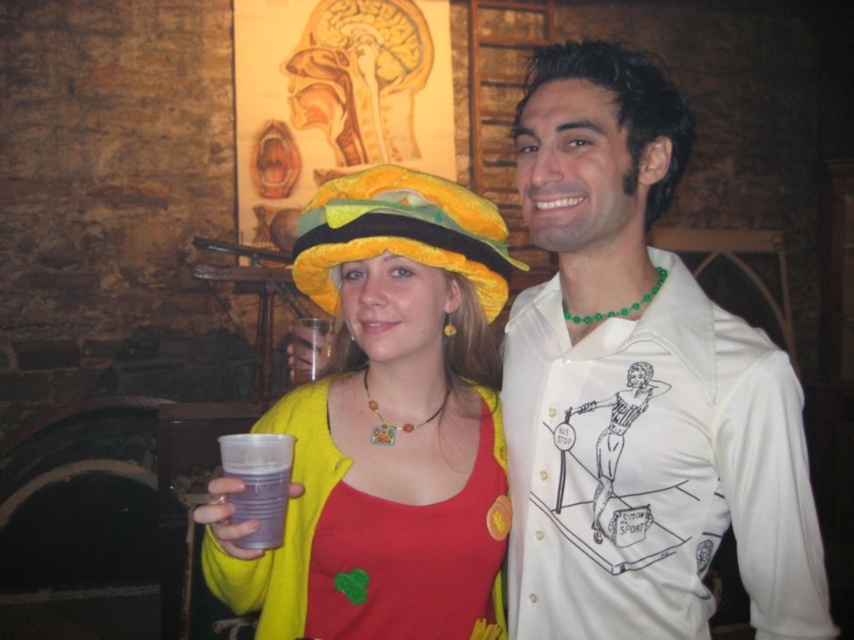
You are at a party and want to take a photo with the white glossy shirt at center and the fuzzy yellow hat at center. Which one should you focus on first if you want to capture both in the same frame?

The white glossy shirt at center is below the fuzzy yellow hat at center, so you should focus on the fuzzy yellow hat at center first to ensure both are in the frame.

You are at a party and want to find the person wearing the white glossy shirt at center. According to the spatial coordinates provided, where should you look relative to the image frame?

The white glossy shirt at center is located at point coordinates 0.606 on the x axis and 0.748 on the y axis, so you should look towards the right and lower middle area of the image frame.

You are a photographer at a party and need to capture a closeup shot of the white glossy shirt at center and the translucent plastic cup at lower center in the same frame. The camera you are using has a minimum focus distance of 20 inches. Can you take the photo without moving either object?

The white glossy shirt at center and translucent plastic cup at lower center are 19.54 inches apart, which is less than the camera minimum focus distance of 20 inches. Therefore, you cannot take the photo without moving either object.